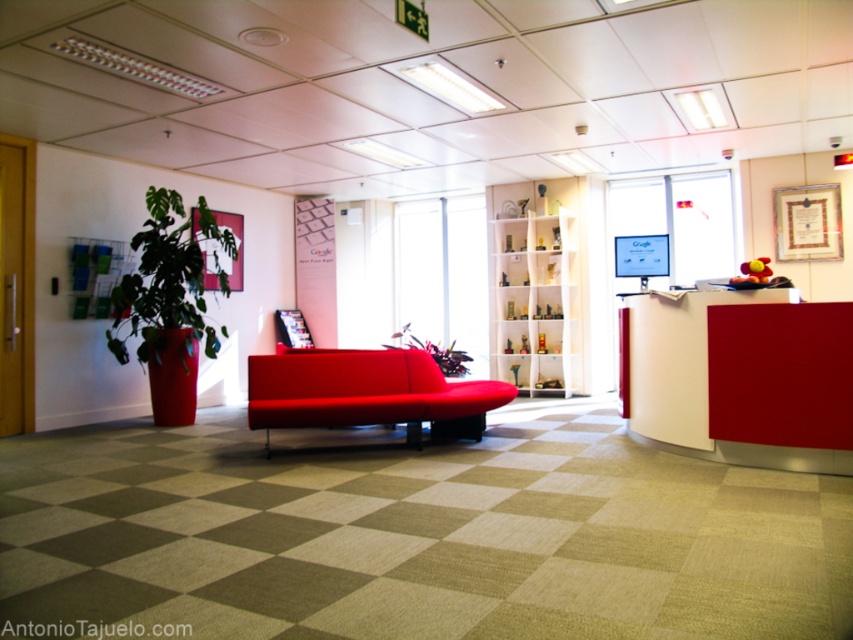
You are an office manager planning to rearrange the furniture. You want to move the matte red couch at center to the right side of the room. Considering the space it currently occupies, will the green matte plant at left need to be moved to accommodate the couch?

The matte red couch at center occupies less space than the green matte plant at left, so moving the couch to the right side would not require moving the green matte plant at left since it takes up more space and can stay in its current position.

You are standing at the entrance of the office reception area and see the point marked at coordinates [367,392]. What object is located at that point?

The point at coordinates [367,392] indicates the location of the matte red couch at center.